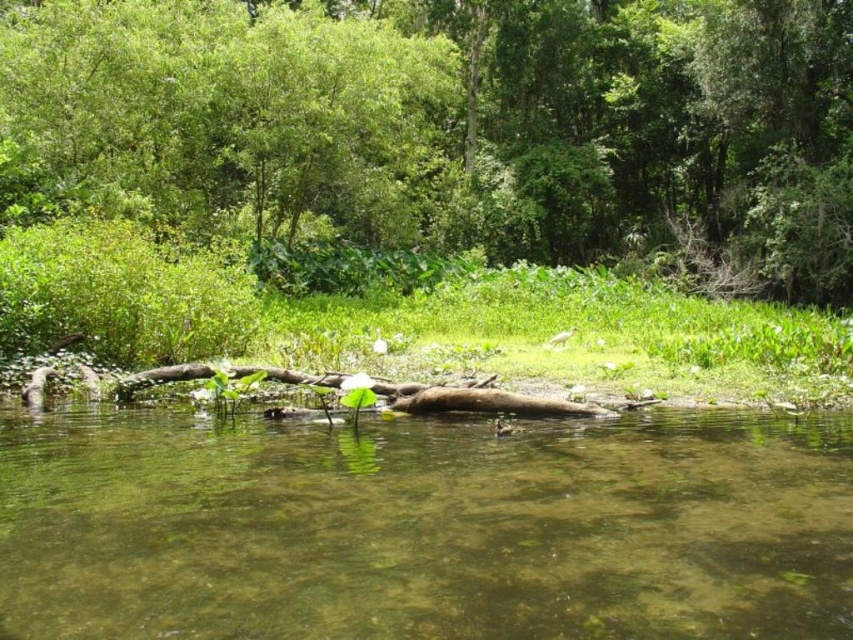
You are an environmental scientist examining the scene. You need to determine which object occupies more horizontal space in the image. Which one is wider between the green leafy tree at upper center and the green translucent water at center?

The green leafy tree at upper center is wider than the green translucent water at center according to the description.

You are standing at the center of the image. Which direction should you look to see the green leafy tree at upper center?

The green leafy tree at upper center is located at point coordinates of (451,125), so you should look towards the upper center direction to see it.

You are a hiker who wants to take a photo of the green leafy tree at upper center and the green translucent water at center. Since you only have one shot, you need to know which object will occupy more space in your camera frame. Which one should you focus on?

The green leafy tree at upper center is larger in size than the green translucent water at center, so you should focus on the green leafy tree at upper center to capture more of it in your frame.